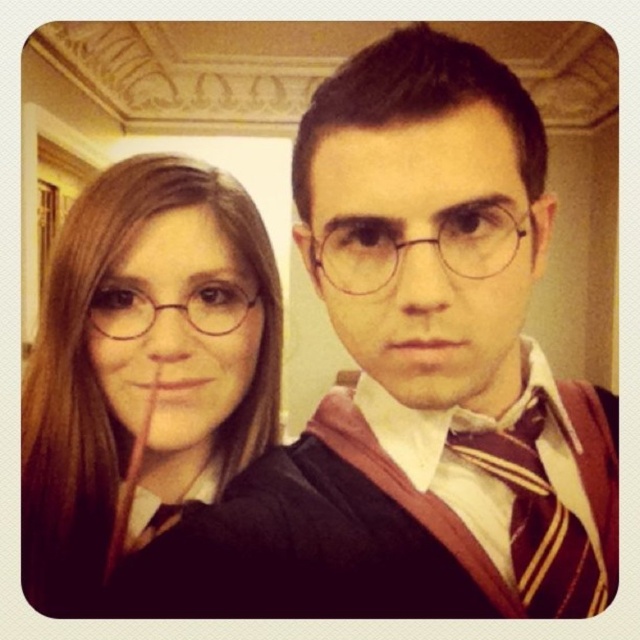
You are a costume designer checking the fit of the costumes. The matte black robe at left and the clear plastic glasses at center are part of the ensemble. Which object is wider in this setup?

The matte black robe at left is wider than the clear plastic glasses at center according to the description.

You are a photographer setting up for a photo shoot with two Harry Potter characters. You notice the striped wool tie at center and the clear plastic glasses at center. Which object is closer to the camera?

The striped wool tie at center is closer to the camera because the clear plastic glasses at center is behind it.

You are at point A and want to move to point B in the Harry Potter themed room. You see two points marked as point (600, 484) and point (346, 225). Which point should you go to if you want to move forward without going behind anything?

You should go to point (346, 225) because point (600, 484) is behind it.